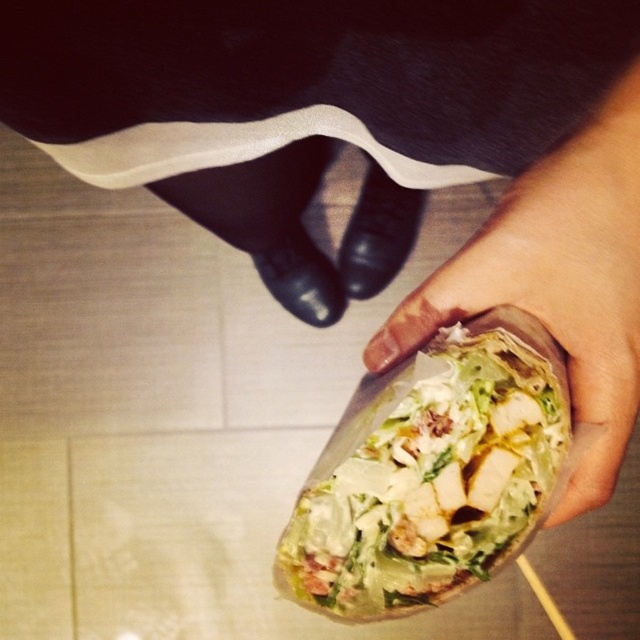
Is green leafy salad at center taller than translucent plastic wrap at lower right?

Incorrect, green leafy salad at center's height is not larger of translucent plastic wrap at lower right's.

Which is behind, point (528, 540) or point (376, 352)?

Positioned behind is point (376, 352).

Between point (396, 426) and point (596, 397), which one is positioned behind?

The point (396, 426) is more distant.

Image resolution: width=640 pixels, height=640 pixels. I want to click on green leafy salad at center, so click(x=428, y=477).